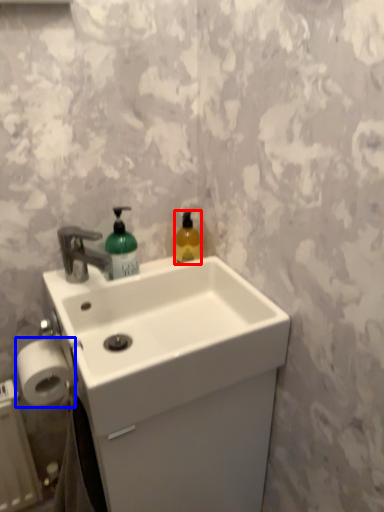
Question: Among these objects, which one is nearest to the camera, bottle (highlighted by a red box) or toilet paper (highlighted by a blue box)?

Choices:
 (A) bottle
 (B) toilet paper

Answer: (B)